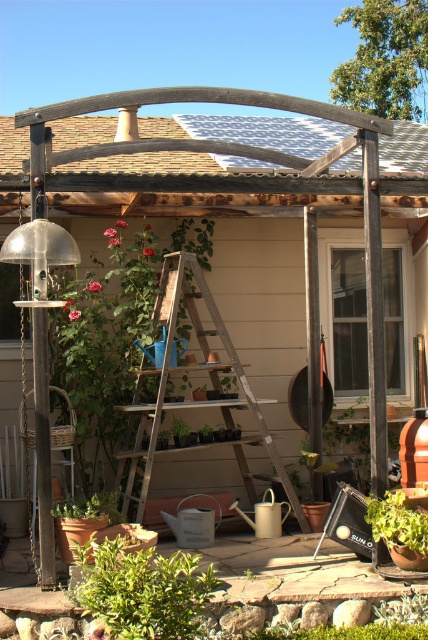
Between point (163, 262) and point (59, 513), which one is positioned behind?

The point (163, 262) is more distant.

Between wooden ladder at center and green matte plant at lower left, which one has less height?

With less height is green matte plant at lower left.

Is point (139, 516) positioned in front of point (82, 512)?

No, it is not.

Locate an element on the screen. This screenshot has height=640, width=428. wooden ladder at center is located at coordinates (195, 369).

Is metallic tile roof at upper center above wooden ladder at center?

Indeed, metallic tile roof at upper center is positioned over wooden ladder at center.

Is metallic tile roof at upper center taller than wooden ladder at center?

No.

Which is in front, point (318, 132) or point (190, 269)?

Point (190, 269)

This screenshot has width=428, height=640. Find the location of `metallic tile roof at upper center`. metallic tile roof at upper center is located at coordinates (252, 131).

Can you confirm if green leafy plant at lower center is taller than green matte plant at lower left?

Yes.

Which of these two, green leafy plant at lower center or green matte plant at lower left, stands shorter?

green matte plant at lower left

You are a GUI agent. You are given a task and a screenshot of the screen. Output one action in this format:
    pyautogui.click(x=<x>, y=<y>)
    Task: Click on the green leafy plant at lower center
    The image size is (428, 640).
    Given the screenshot: What is the action you would take?
    pyautogui.click(x=142, y=589)

At what (x,y) coordinates should I click in order to perform the action: click on green leafy plant at lower center. Please return your answer as a coordinate pair (x, y). Looking at the image, I should click on (142, 589).